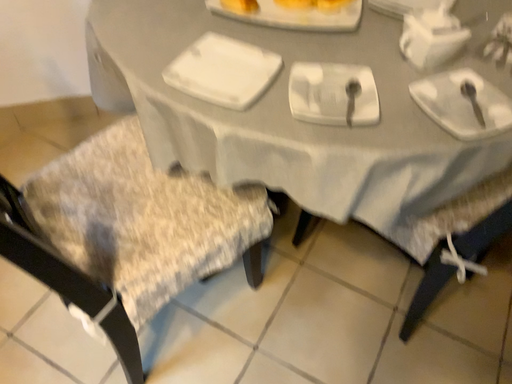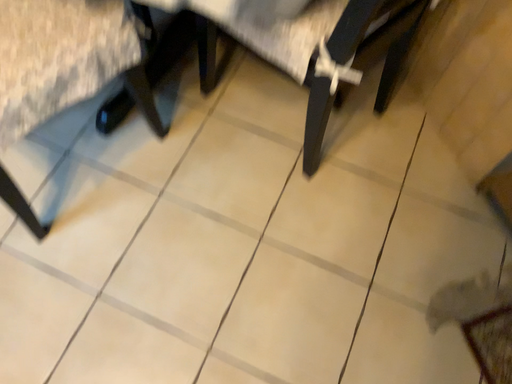
Question: Which way did the camera rotate in the video?

Choices:
 (A) rotated downward
 (B) rotated upward

Answer: (A)